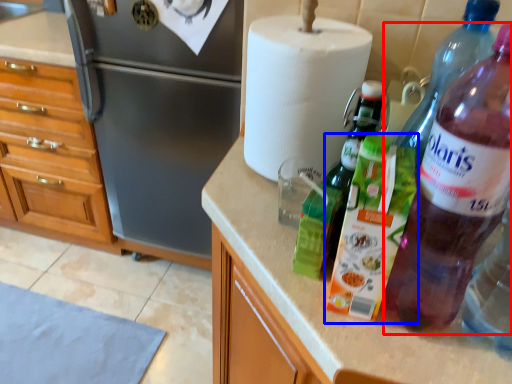
Question: Which object appears farthest to the camera in this image, bottle (highlighted by a red box) or bottle (highlighted by a blue box)?

Choices:
 (A) bottle
 (B) bottle

Answer: (B)